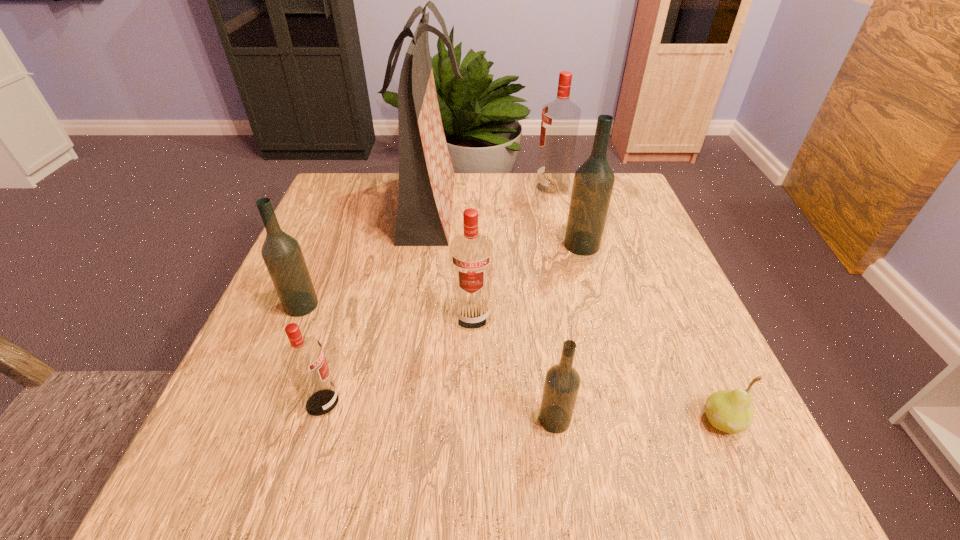
This screenshot has height=540, width=960. What are the coordinates of `black vodka object that ranks as the third closest to the green pear` in the screenshot? It's located at (282, 254).

This screenshot has height=540, width=960. What are the coordinates of `the second closest black vodka to the tallest object` in the screenshot? It's located at (593, 183).

Identify the location of blank area in the image that satisfies the following two spatial constraints: 1. on the front label of the smallest black vodka; 2. on the right side of the fifth vodka from right to left. (317, 420).

The image size is (960, 540). In order to click on vacant space that satisfies the following two spatial constraints: 1. on the front label of the rightmost red vodka; 2. on the front label of the third vodka from left to right in this screenshot , I will do `click(583, 317)`.

Find the location of a particular element. Image resolution: width=960 pixels, height=540 pixels. blank area in the image that satisfies the following two spatial constraints: 1. on the back side of the smallest black vodka; 2. on the front label of the seventh object from right to left is located at coordinates (553, 403).

This screenshot has width=960, height=540. What are the coordinates of `free space that satisfies the following two spatial constraints: 1. on the front-facing side of the fourth vodka from left to right; 2. on the right side of the shopping bag` in the screenshot? It's located at (399, 420).

Find the location of a particular element. This screenshot has height=540, width=960. blank area in the image that satisfies the following two spatial constraints: 1. on the back side of the fifth object from left to right; 2. on the front-facing side of the shopping bag is located at coordinates (525, 206).